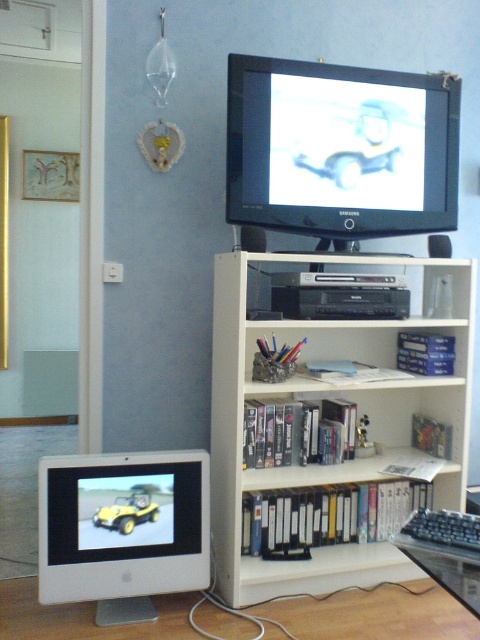
From the picture: You are organizing a space and need to move the white wood bookshelf at center. Which object, the matte black monitor at upper center or another object, would you need to adjust first?

The white wood bookshelf at center is in front of the matte black monitor at upper center, so you would need to adjust the white wood bookshelf first to access or reposition the matte black monitor at upper center.

You are standing in front of the bookshelf and want to place a small plant between the two points marked as point (332, 577) and point (154, 499). Which point should the plant be closer to in order to be closer to the camera?

The plant should be closer to point (332, 577) because it is further to the camera than point (154, 499).

You are setting up a new desk lamp and need to choose between placing it on the white wood bookshelf at center or the white glossy computer monitor at lower left. Which surface has a larger width to accommodate the lamp?

The white wood bookshelf at center has a larger width than the white glossy computer monitor at lower left, so it can accommodate the lamp better.